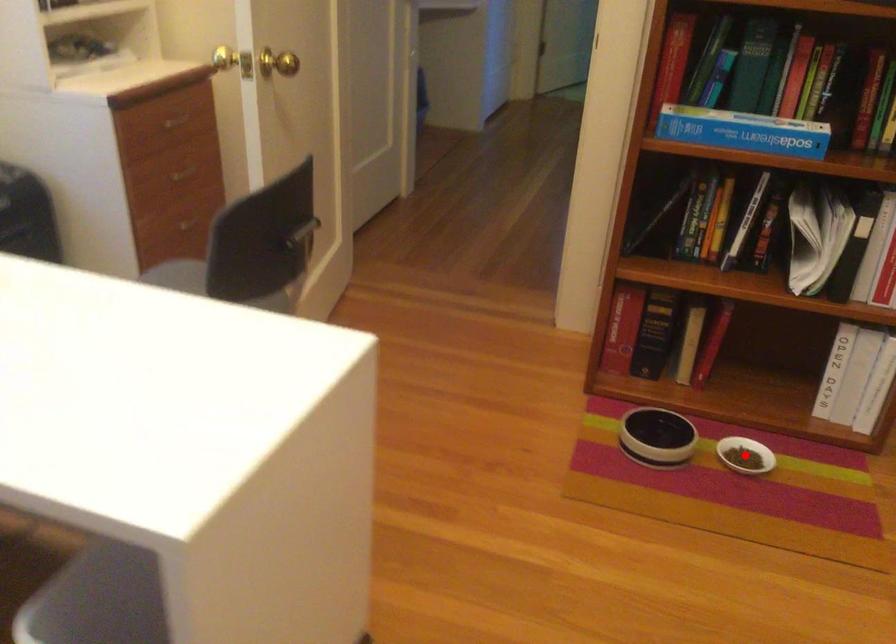
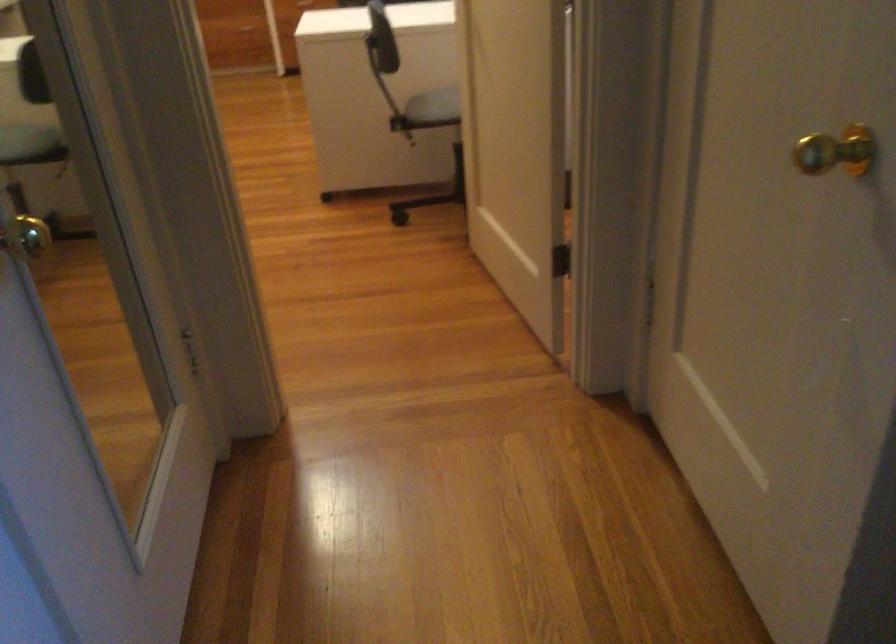
Question: I am providing you with two images of the same scene from different viewpoints. A red point is marked on the first image. Can you still see the location of the red point in image 2?

Choices:
 (A) Yes
 (B) No

Answer: (B)